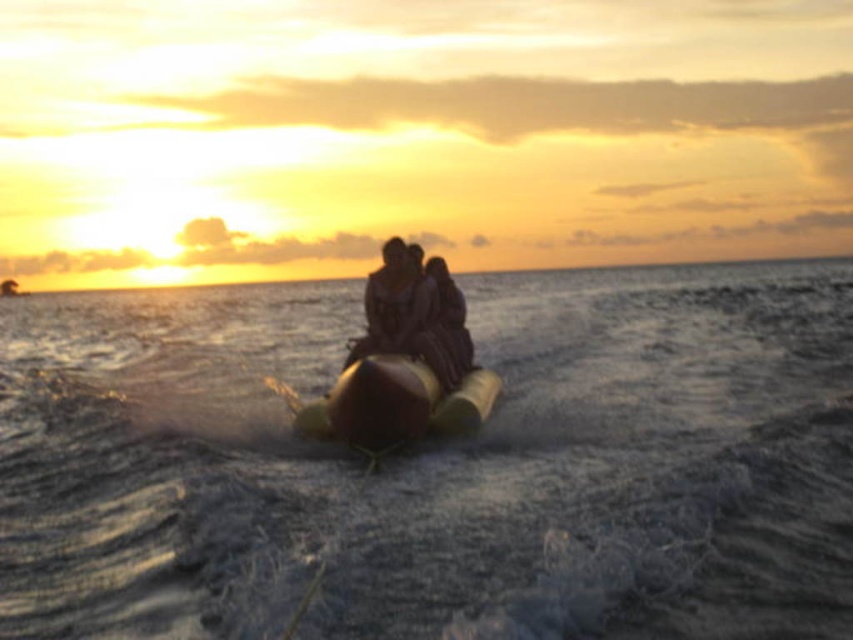
Between point (386, 381) and point (361, 353), which one is positioned in front?

Point (386, 381)

Does point (439, 419) come closer to viewer compared to point (456, 346)?

That is True.

Where is `yellow rubber boat at center`? yellow rubber boat at center is located at coordinates (395, 404).

Is translucent rubber water at center above smooth yellow banana boat at center?

Indeed, translucent rubber water at center is positioned over smooth yellow banana boat at center.

In the scene shown: Does translucent rubber water at center appear on the right side of smooth yellow banana boat at center?

Indeed, translucent rubber water at center is positioned on the right side of smooth yellow banana boat at center.

What do you see at coordinates (436, 465) in the screenshot?
I see `translucent rubber water at center` at bounding box center [436, 465].

Locate an element on the screen. The width and height of the screenshot is (853, 640). translucent rubber water at center is located at coordinates (436, 465).

Is translucent rubber water at center below yellow rubber boat at center?

No.

Is translucent rubber water at center closer to the viewer compared to yellow rubber boat at center?

That is True.

Which is behind, point (834, 429) or point (403, 362)?

The point (834, 429) is more distant.

At what (x,y) coordinates should I click in order to perform the action: click on translucent rubber water at center. Please return your answer as a coordinate pair (x, y). Image resolution: width=853 pixels, height=640 pixels. Looking at the image, I should click on (436, 465).